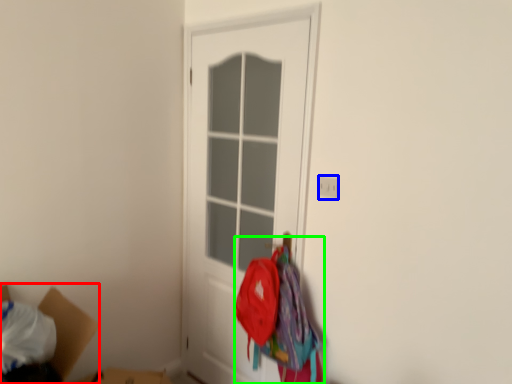
Question: Estimate the real-world distances between objects in this image. Which object is farther from cardboard box (highlighted by a red box), electric outlet (highlighted by a blue box) or laundry (highlighted by a green box)?

Choices:
 (A) electric outlet
 (B) laundry

Answer: (A)